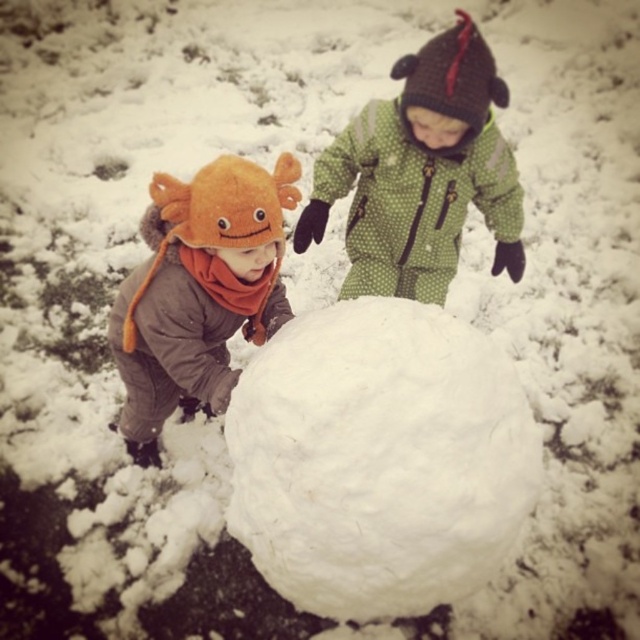
Question: Does white fluffy snowball at center have a smaller size compared to green dotted snowsuit at center?

Choices:
 (A) yes
 (B) no

Answer: (A)

Question: In this image, where is white fluffy snowball at center located relative to green dotted snowsuit at center?

Choices:
 (A) below
 (B) above

Answer: (A)

Question: Which point is farther from the camera taking this photo?

Choices:
 (A) (422, 221)
 (B) (243, 284)
 (C) (291, 371)

Answer: (A)

Question: Among these points, which one is farthest from the camera?

Choices:
 (A) (403, 330)
 (B) (177, 349)

Answer: (B)

Question: Does green dotted snowsuit at center appear on the right side of orange fuzzy hat at left?

Choices:
 (A) no
 (B) yes

Answer: (B)

Question: Which of the following is the farthest from the observer?

Choices:
 (A) (476, 112)
 (B) (161, 179)

Answer: (A)